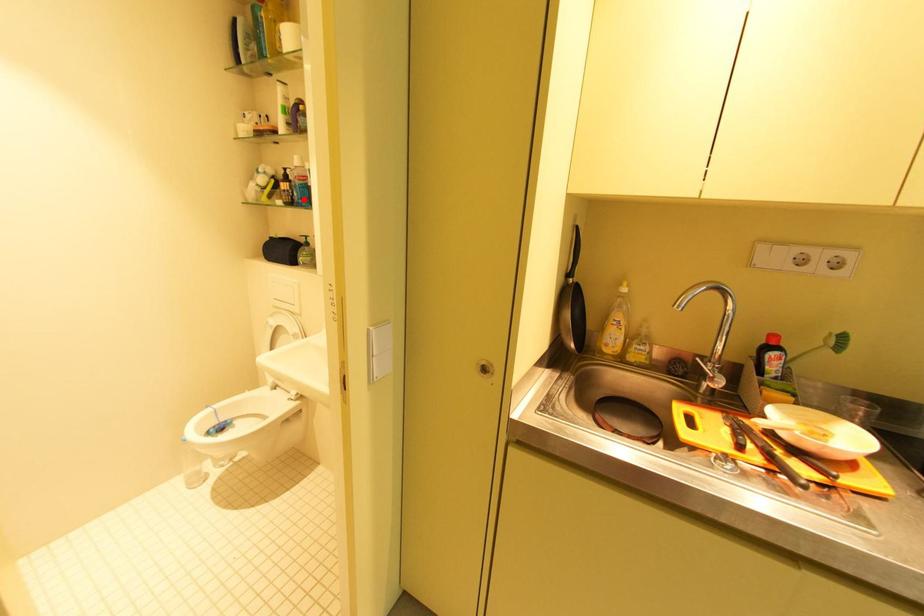
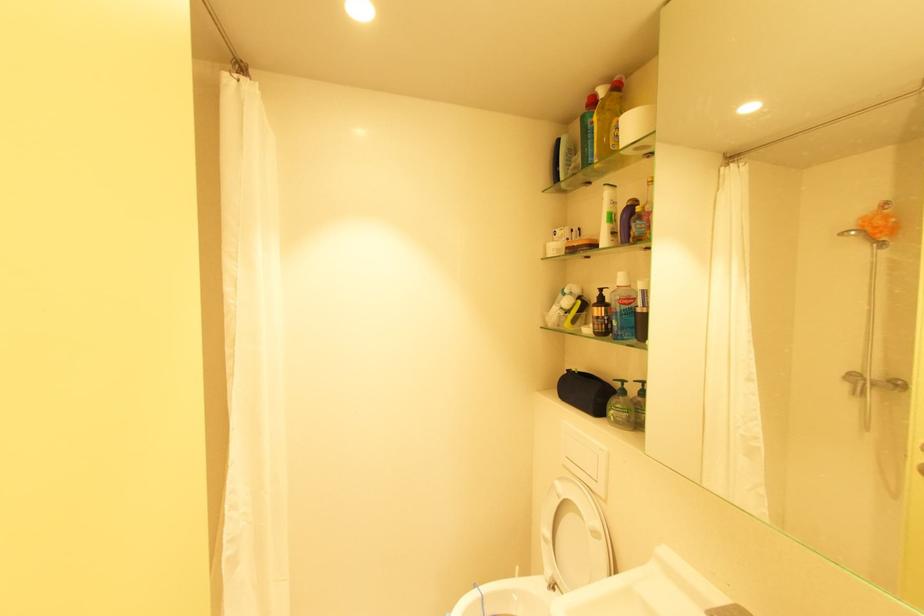
Where in the second image is the point corresponding to the highlighted location from the first image?

(623, 330)